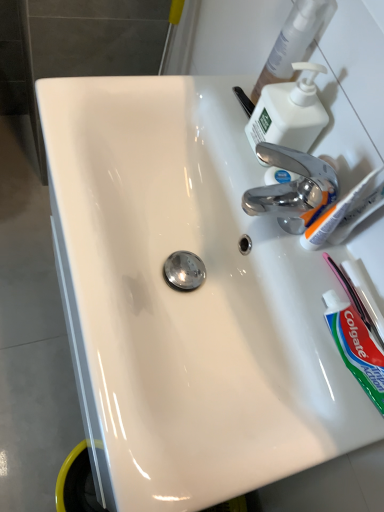
The height and width of the screenshot is (512, 384). I want to click on vacant region in front of white plastic toothbrush at upper right, positioned as the 1th toothbrush in top-to-bottom order, so click(x=296, y=340).